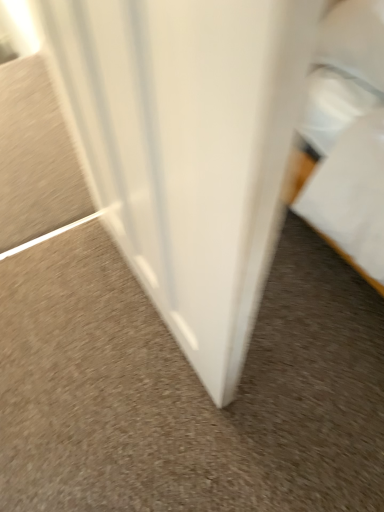
Measure the distance between white glossy door at center and camera.

A distance of 10.02 inches exists between white glossy door at center and camera.

The height and width of the screenshot is (512, 384). In order to click on white glossy door at center in this screenshot , I will do `click(187, 149)`.

Image resolution: width=384 pixels, height=512 pixels. Describe the element at coordinates (187, 149) in the screenshot. I see `white glossy door at center` at that location.

Find the location of `white glossy door at center`. white glossy door at center is located at coordinates (187, 149).